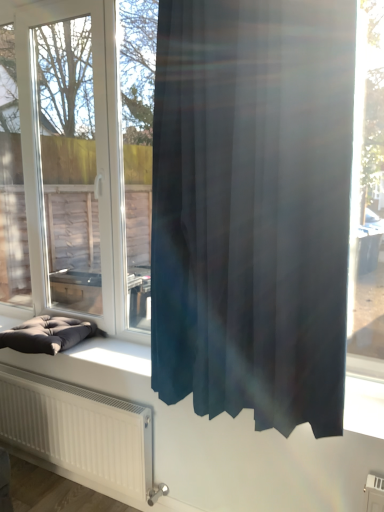
Where is `satin dark blue curtain at center`? The height and width of the screenshot is (512, 384). satin dark blue curtain at center is located at coordinates (253, 208).

Measure the distance between point (269, 396) and camera.

The distance of point (269, 396) from camera is 1.40 meters.

Identify the location of transparent glass window at center. click(x=71, y=170).

This screenshot has height=512, width=384. Identify the location of satin dark blue curtain at center. (253, 208).

Is dark gray fabric cushion at lower left not close to satin dark blue curtain at center?

dark gray fabric cushion at lower left is positioned a significant distance from satin dark blue curtain at center.

From a real-world perspective, is dark gray fabric cushion at lower left positioned above or below satin dark blue curtain at center?

From a real-world perspective, dark gray fabric cushion at lower left is physically below satin dark blue curtain at center.

From the image's perspective, is dark gray fabric cushion at lower left positioned above or below satin dark blue curtain at center?

From the image's perspective, dark gray fabric cushion at lower left appears below satin dark blue curtain at center.

Which object is wider, dark gray fabric cushion at lower left or satin dark blue curtain at center?

dark gray fabric cushion at lower left.

From the image's perspective, is dark gray fabric cushion at lower left located beneath transparent glass window at center?

Correct, dark gray fabric cushion at lower left appears lower than transparent glass window at center in the image.

From the picture: Is dark gray fabric cushion at lower left turned away from transparent glass window at center?

Yes, dark gray fabric cushion at lower left is facing away from transparent glass window at center.

Which is further, (82, 326) or (96, 80)?

The point (82, 326) is farther from the camera.

Which object is positioned more to the left, dark gray fabric cushion at lower left or transparent glass window at center?

From the viewer's perspective, dark gray fabric cushion at lower left appears more on the left side.

From the image's perspective, does satin dark blue curtain at center appear higher than dark gray fabric cushion at lower left?

Yes, from the image's perspective, satin dark blue curtain at center is over dark gray fabric cushion at lower left.

Is dark gray fabric cushion at lower left at the back of satin dark blue curtain at center?

satin dark blue curtain at center is not turned away from dark gray fabric cushion at lower left.

In terms of size, does satin dark blue curtain at center appear bigger or smaller than dark gray fabric cushion at lower left?

Clearly, satin dark blue curtain at center is larger in size than dark gray fabric cushion at lower left.

How many degrees apart are the facing directions of satin dark blue curtain at center and transparent glass window at center?

0.0088 degrees.

Is satin dark blue curtain at center bigger or smaller than transparent glass window at center?

satin dark blue curtain at center is smaller than transparent glass window at center.

Which is in front, satin dark blue curtain at center or transparent glass window at center?

satin dark blue curtain at center.

Consider the image. From a real-world perspective, relative to transparent glass window at center, is satin dark blue curtain at center vertically above or below?

satin dark blue curtain at center is situated lower than transparent glass window at center in the real world.

Is transparent glass window at center wider or thinner than satin dark blue curtain at center?

transparent glass window at center is thinner than satin dark blue curtain at center.

Which of these two, transparent glass window at center or satin dark blue curtain at center, stands shorter?

satin dark blue curtain at center is shorter.

Who is more distant, transparent glass window at center or satin dark blue curtain at center?

transparent glass window at center is further away from the camera.

Do you think transparent glass window at center is within satin dark blue curtain at center, or outside of it?

transparent glass window at center lies outside satin dark blue curtain at center.

Could you tell me if transparent glass window at center is facing dark gray fabric cushion at lower left?

Yes, transparent glass window at center is turned towards dark gray fabric cushion at lower left.

What's the angular difference between transparent glass window at center and dark gray fabric cushion at lower left's facing directions?

6.21 degrees separate the facing orientations of transparent glass window at center and dark gray fabric cushion at lower left.

Which object is further away from the camera, transparent glass window at center or dark gray fabric cushion at lower left?

dark gray fabric cushion at lower left is further from the camera.

From the image's perspective, between transparent glass window at center and dark gray fabric cushion at lower left, who is located below?

dark gray fabric cushion at lower left.

Identify the location of curtain in front of the dark gray fabric cushion at lower left. The width and height of the screenshot is (384, 512). (x=253, y=208).

I want to click on furniture on the left of transparent glass window at center, so click(x=48, y=334).

Based on their spatial positions, is satin dark blue curtain at center or transparent glass window at center closer to dark gray fabric cushion at lower left?

transparent glass window at center is positioned closer to the anchor dark gray fabric cushion at lower left.

Estimate the real-world distances between objects in this image. Which object is closer to dark gray fabric cushion at lower left, transparent glass window at center or satin dark blue curtain at center?

The object closer to dark gray fabric cushion at lower left is transparent glass window at center.

Looking at the image, which one is located closer to satin dark blue curtain at center, dark gray fabric cushion at lower left or transparent glass window at center?

dark gray fabric cushion at lower left lies closer to satin dark blue curtain at center than the other object.

From the picture: Based on their spatial positions, is dark gray fabric cushion at lower left or satin dark blue curtain at center closer to transparent glass window at center?

dark gray fabric cushion at lower left.

Estimate the real-world distances between objects in this image. Which object is closer to transparent glass window at center, satin dark blue curtain at center or dark gray fabric cushion at lower left?

dark gray fabric cushion at lower left is closer to transparent glass window at center.

Based on their spatial positions, is transparent glass window at center or dark gray fabric cushion at lower left closer to satin dark blue curtain at center?

dark gray fabric cushion at lower left lies closer to satin dark blue curtain at center than the other object.

Find the location of a particular element. window situated between dark gray fabric cushion at lower left and satin dark blue curtain at center from left to right is located at coordinates (71, 170).